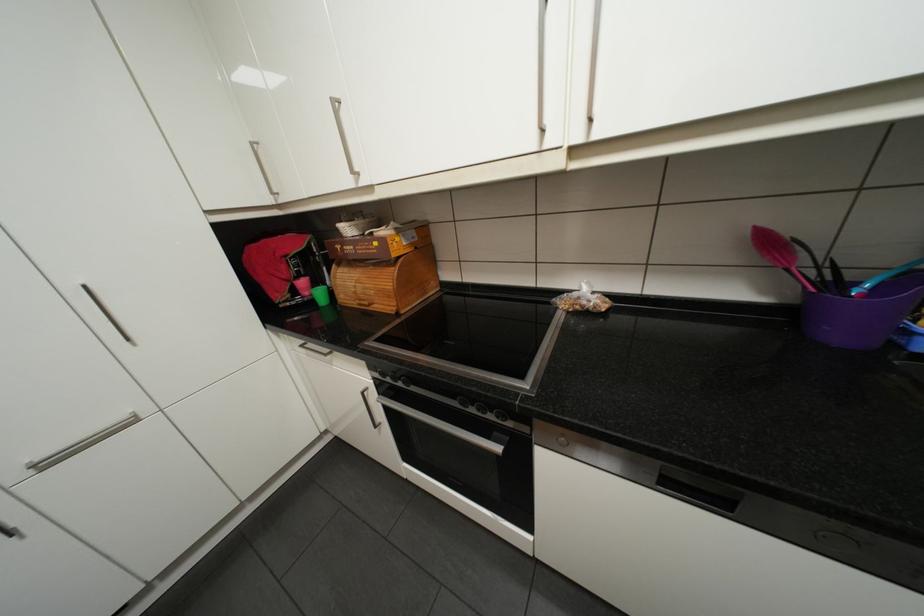
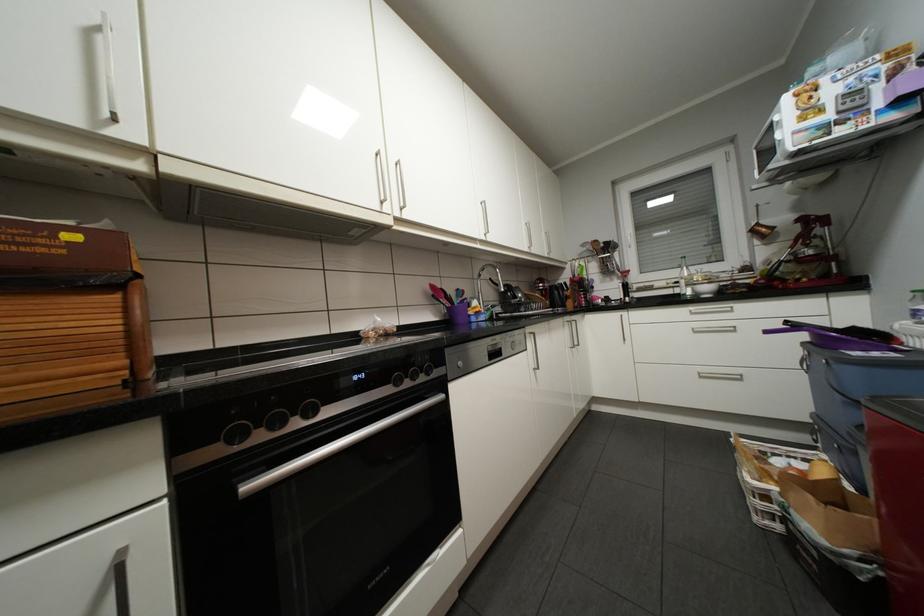
Question: The camera is either moving clockwise (left) or counter-clockwise (right) around the object. The first image is from the beginning of the video and the second image is from the end. Is the camera moving left or right when shooting the video?

Choices:
 (A) Left
 (B) Right

Answer: (A)